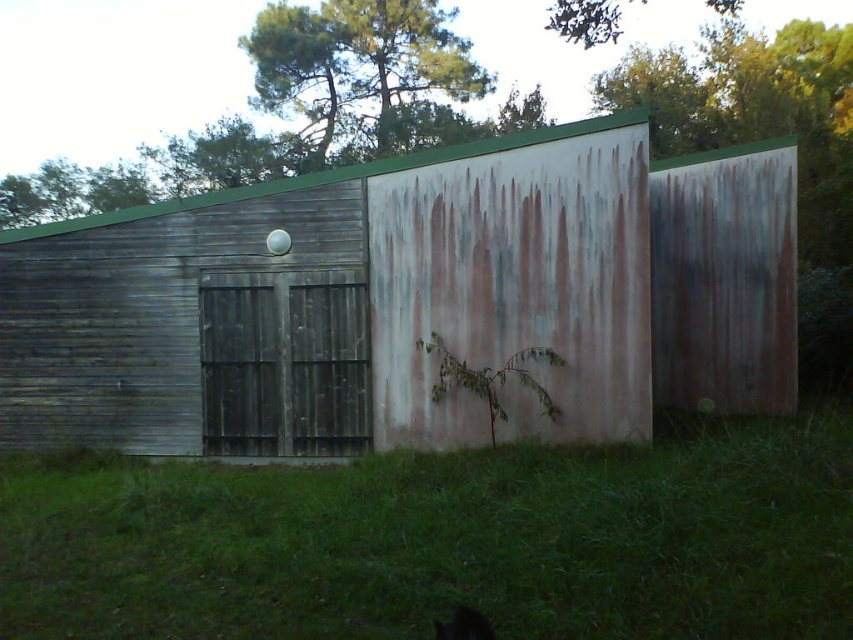
Between point (602, 340) and point (332, 24), which one is positioned in front?

Point (602, 340)

Does rusty metal barn at center appear on the right side of green leafy tree at upper center?

Indeed, rusty metal barn at center is positioned on the right side of green leafy tree at upper center.

Where is `rusty metal barn at center`? The width and height of the screenshot is (853, 640). rusty metal barn at center is located at coordinates (403, 300).

Find the location of a particular element. rusty metal barn at center is located at coordinates (403, 300).

Which of these two, green grass at lower center or green leafy tree at upper center, stands shorter?

green grass at lower center is shorter.

Does green grass at lower center have a lesser width compared to green leafy tree at upper center?

In fact, green grass at lower center might be wider than green leafy tree at upper center.

Image resolution: width=853 pixels, height=640 pixels. I want to click on green grass at lower center, so click(445, 541).

Does rusty metal barn at center have a lesser height compared to green grass at lower center?

In fact, rusty metal barn at center may be taller than green grass at lower center.

In the scene shown: Is rusty metal barn at center further to the viewer compared to green grass at lower center?

Yes, it is.

What are the coordinates of `rusty metal barn at center` in the screenshot? It's located at (403, 300).